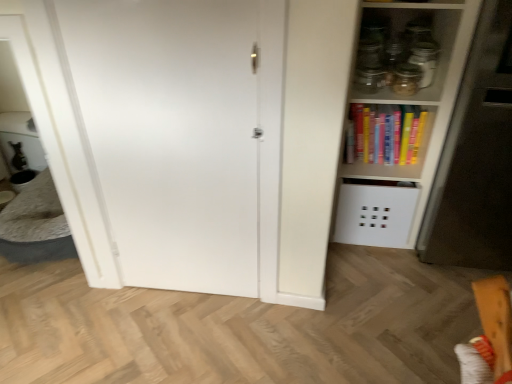
Question: From the image's perspective, is white glossy table at left located beneath hardcover books at upper right?

Choices:
 (A) no
 (B) yes

Answer: (B)

Question: Can you confirm if white glossy table at left is positioned to the left of hardcover books at upper right?

Choices:
 (A) yes
 (B) no

Answer: (A)

Question: Is white glossy table at left further to camera compared to hardcover books at upper right?

Choices:
 (A) yes
 (B) no

Answer: (A)

Question: Considering the relative sizes of white glossy table at left and hardcover books at upper right in the image provided, is white glossy table at left wider than hardcover books at upper right?

Choices:
 (A) yes
 (B) no

Answer: (A)

Question: Are white glossy table at left and hardcover books at upper right far apart?

Choices:
 (A) yes
 (B) no

Answer: (A)

Question: From a real-world perspective, does white glossy table at left sit lower than hardcover books at upper right?

Choices:
 (A) yes
 (B) no

Answer: (A)

Question: Can you confirm if transparent glass jar at upper right, the second glass jar positioned from the right, is smaller than white matte door at center?

Choices:
 (A) yes
 (B) no

Answer: (A)

Question: Can you confirm if transparent glass jar at upper right, the second glass jar positioned from the right, is positioned to the right of white matte door at center?

Choices:
 (A) yes
 (B) no

Answer: (A)

Question: Does transparent glass jar at upper right, the second glass jar positioned from the right, have a lesser height compared to white matte door at center?

Choices:
 (A) no
 (B) yes

Answer: (B)

Question: From the image's perspective, is transparent glass jar at upper right, the second glass jar positioned from the right, under white matte door at center?

Choices:
 (A) no
 (B) yes

Answer: (A)

Question: Is transparent glass jar at upper right, which appears as the first glass jar when viewed from the left, bigger than white matte door at center?

Choices:
 (A) yes
 (B) no

Answer: (B)

Question: Is transparent glass jar at upper right, the second glass jar positioned from the right, wider than white matte door at center?

Choices:
 (A) no
 (B) yes

Answer: (B)

Question: Could you tell me if hardcover books at upper right is facing transparent glass jar at upper right, the first glass jar in the right-to-left sequence?

Choices:
 (A) yes
 (B) no

Answer: (B)